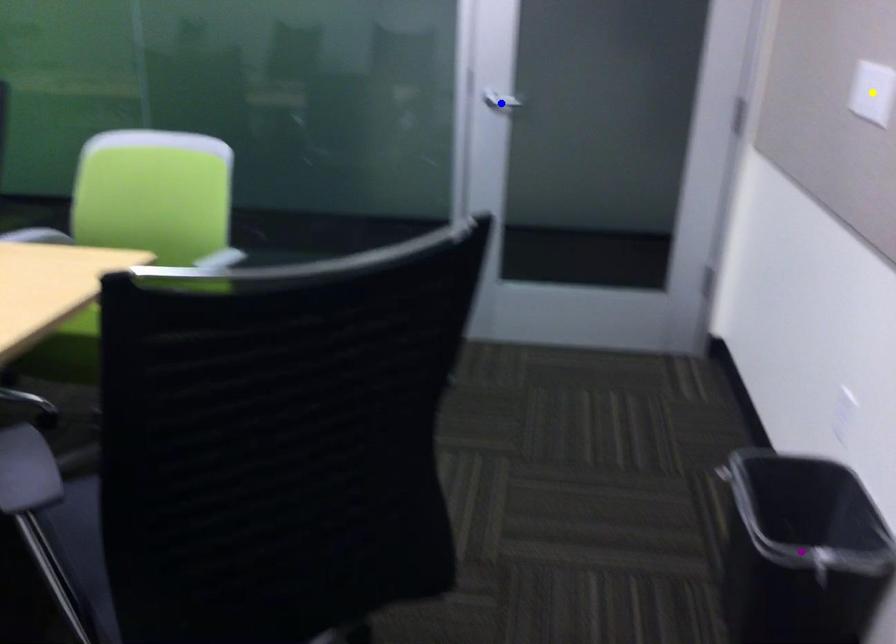
Order these from nearest to farthest:
- blue point
- yellow point
- purple point

blue point < yellow point < purple point